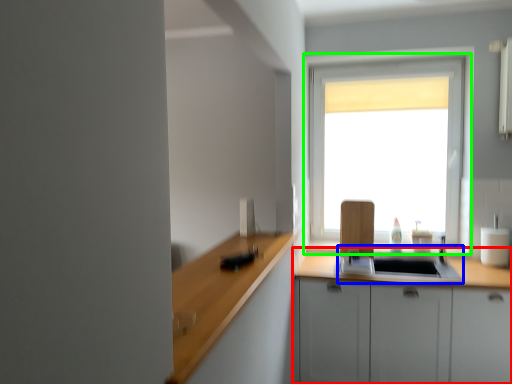
Question: Estimate the real-world distances between objects in this image. Which object is farther from cabinetry (highlighted by a red box), sink (highlighted by a blue box) or window (highlighted by a green box)?

Choices:
 (A) sink
 (B) window

Answer: (B)